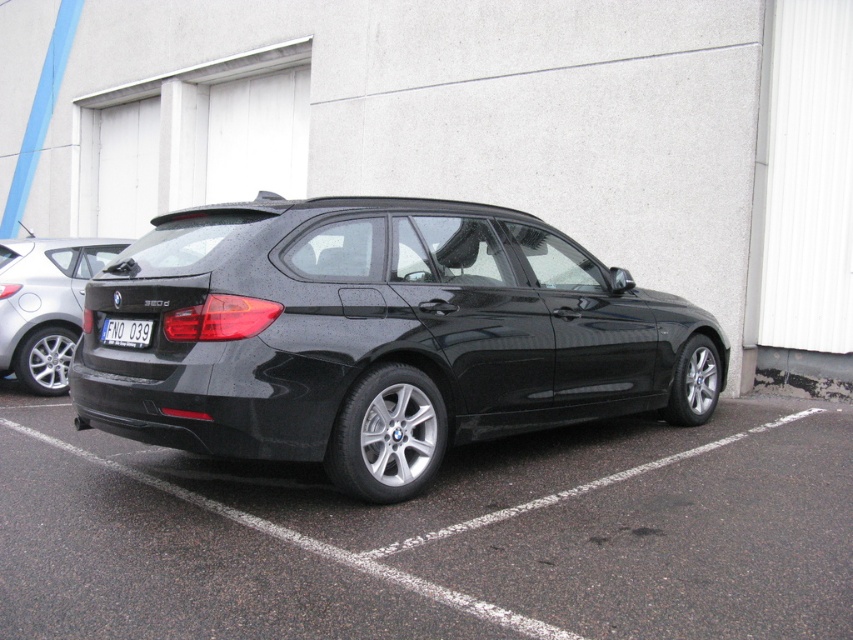
Question: Which point is farther to the camera?

Choices:
 (A) (346, 509)
 (B) (645, 348)
 (C) (73, 260)
 (D) (132, 342)

Answer: (C)

Question: Does black rubber parking lot at lower right have a larger size compared to matte black car at lower left?

Choices:
 (A) no
 (B) yes

Answer: (A)

Question: Which object is closer to the camera taking this photo?

Choices:
 (A) glossy black car at center
 (B) black rubber parking lot at lower right
 (C) black plastic license plate at center

Answer: (B)

Question: Is glossy black car at center to the left of black plastic license plate at center from the viewer's perspective?

Choices:
 (A) no
 (B) yes

Answer: (A)

Question: Which object is positioned closest to the matte black car at lower left?

Choices:
 (A) glossy black car at center
 (B) black rubber parking lot at lower right
 (C) black plastic license plate at center

Answer: (C)

Question: Is black rubber parking lot at lower right above black plastic license plate at center?

Choices:
 (A) yes
 (B) no

Answer: (B)